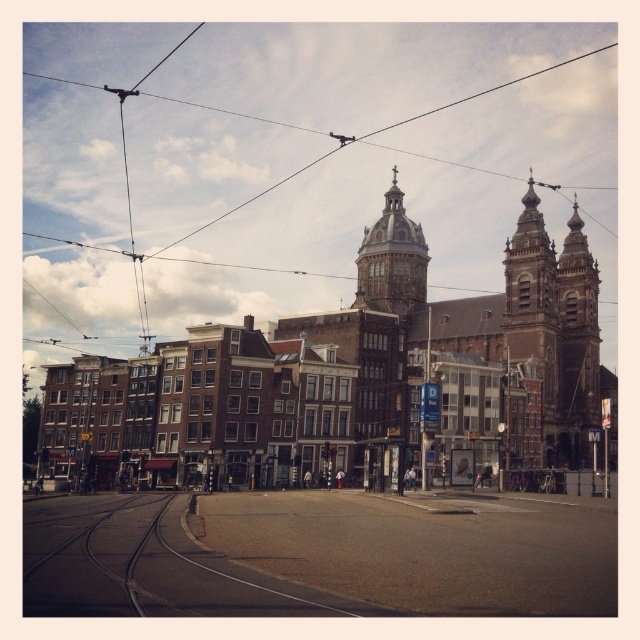
Question: In this image, where is brown stone church at center located relative to smooth asphalt train track at center?

Choices:
 (A) below
 (B) above

Answer: (B)

Question: Which point is farther from the camera taking this photo?

Choices:
 (A) (67, 579)
 (B) (115, 548)
 (C) (358, 260)

Answer: (C)

Question: Is metallic wire at upper center to the right of golden stone dome at center from the viewer's perspective?

Choices:
 (A) no
 (B) yes

Answer: (A)

Question: Is metallic wire at upper center further to the viewer compared to golden stone dome at center?

Choices:
 (A) no
 (B) yes

Answer: (B)

Question: Which point is farther to the camera?

Choices:
 (A) dark gray asphalt train track at lower left
 (B) golden stone dome at center
 (C) smooth asphalt train track at center
 (D) metallic wire at upper center

Answer: (D)

Question: Which point is closer to the camera taking this photo?

Choices:
 (A) (362, 301)
 (B) (56, 360)
 (C) (369, 413)

Answer: (C)